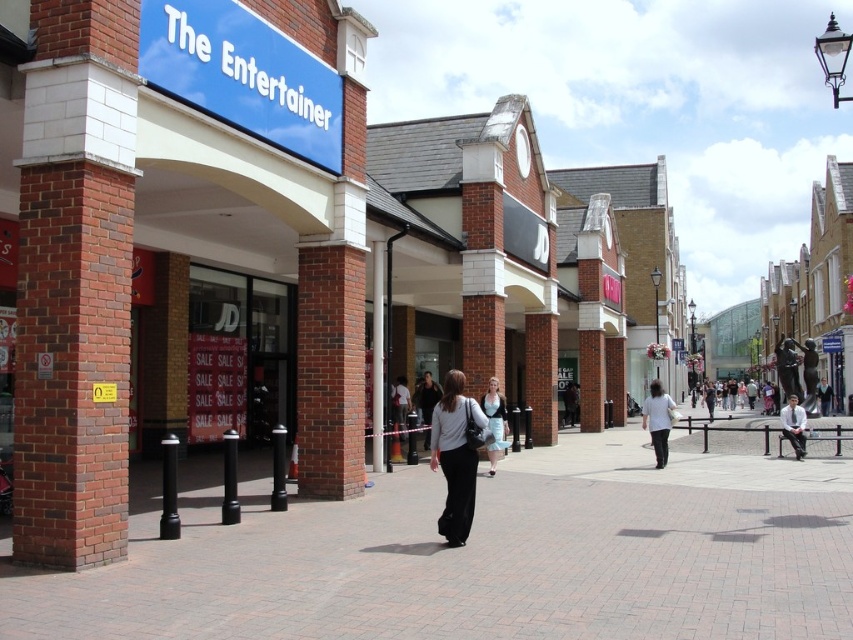
Between white fabric shirt at center and white shirt at center, which one is positioned higher?

white shirt at center is above.

Is point (654, 397) less distant than point (792, 429)?

Yes, point (654, 397) is closer to viewer.

Locate an element on the screen. This screenshot has width=853, height=640. white fabric shirt at center is located at coordinates [657, 420].

Image resolution: width=853 pixels, height=640 pixels. I want to click on brick pavement at center, so click(x=486, y=556).

Looking at this image, can you confirm if brick pavement at center is thinner than light blue dress at center?

No.

Identify the location of brick pavement at center. (x=486, y=556).

Locate an element on the screen. This screenshot has width=853, height=640. brick pavement at center is located at coordinates (486, 556).

At what (x,y) coordinates should I click in order to perform the action: click on light gray fabric pants at center. Please return your answer as a coordinate pair (x, y). The image size is (853, 640). Looking at the image, I should click on (456, 456).